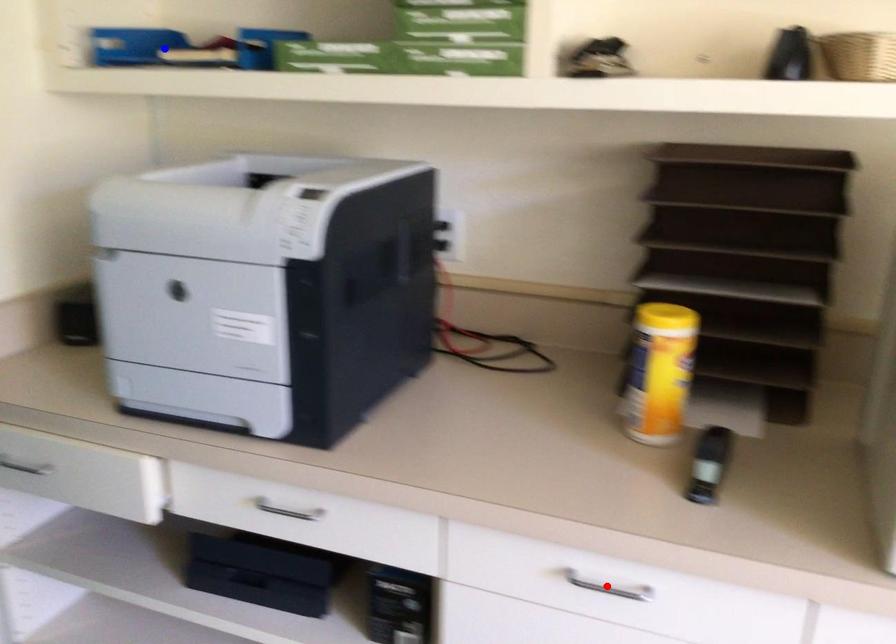
Question: In the image, two points are highlighted. Which point is nearer to the camera? Reply with the corresponding letter.

Choices:
 (A) blue point
 (B) red point

Answer: (B)